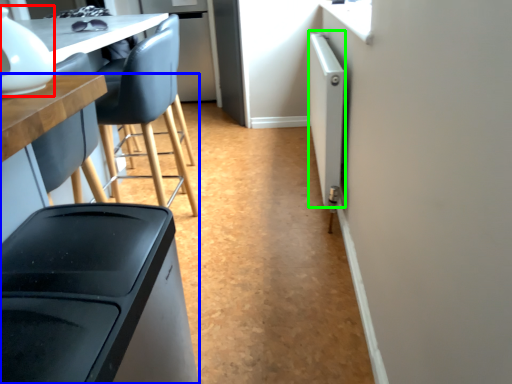
Question: Which object is the closest to the appliance (highlighted by a red box)? Choose among these: table (highlighted by a blue box) or appliance (highlighted by a green box).

Choices:
 (A) table
 (B) appliance

Answer: (A)